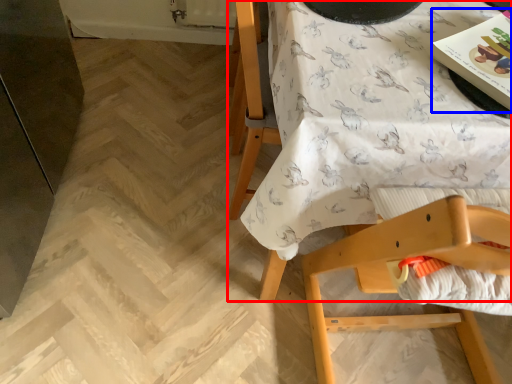
Question: Among these objects, which one is nearest to the camera, table (highlighted by a red box) or magazine (highlighted by a blue box)?

Choices:
 (A) table
 (B) magazine

Answer: (A)